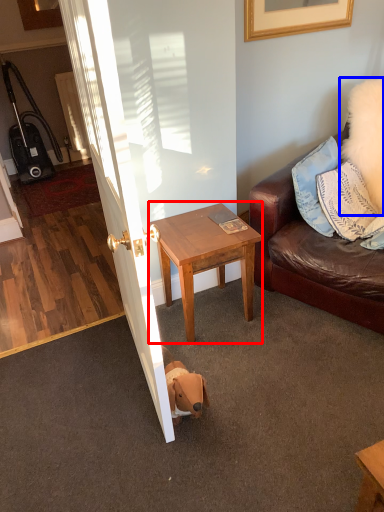
Question: Among these objects, which one is nearest to the camera, table (highlighted by a red box) or pillow (highlighted by a blue box)?

Choices:
 (A) table
 (B) pillow

Answer: (A)